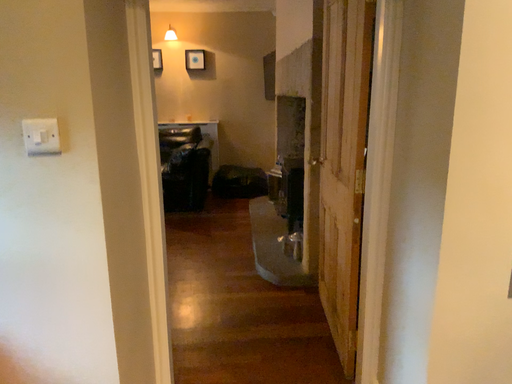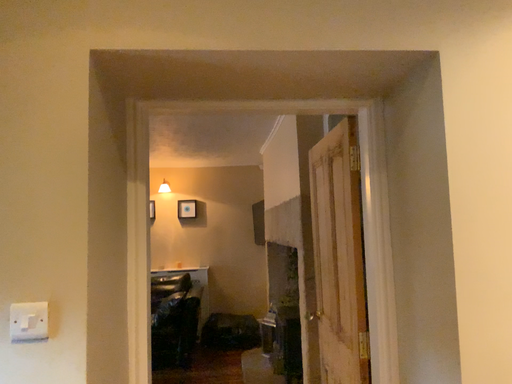
Question: Which way did the camera rotate in the video?

Choices:
 (A) rotated upward
 (B) rotated downward

Answer: (A)